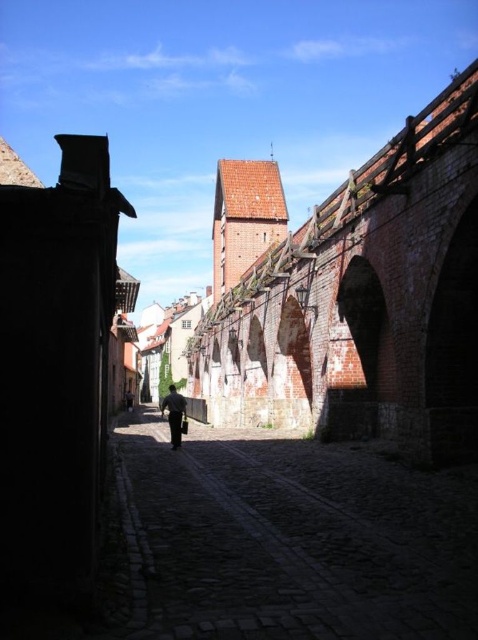
Question: Which point is farther to the camera?

Choices:
 (A) dark blue fabric at center
 (B) dark cobblestone path at center
 (C) dark gray fabric pants at center

Answer: (A)

Question: Does dark gray fabric pants at center appear under dark blue fabric at center?

Choices:
 (A) no
 (B) yes

Answer: (A)

Question: Which of the following is the farthest from the observer?

Choices:
 (A) dark blue fabric at center
 (B) dark cobblestone path at center

Answer: (A)

Question: Estimate the real-world distances between objects in this image. Which object is farther from the dark cobblestone path at center?

Choices:
 (A) dark blue fabric at center
 (B) dark gray fabric pants at center

Answer: (A)

Question: Can you confirm if dark gray fabric pants at center is wider than dark blue fabric at center?

Choices:
 (A) yes
 (B) no

Answer: (A)

Question: Is dark cobblestone path at center positioned behind dark gray fabric pants at center?

Choices:
 (A) yes
 (B) no

Answer: (B)